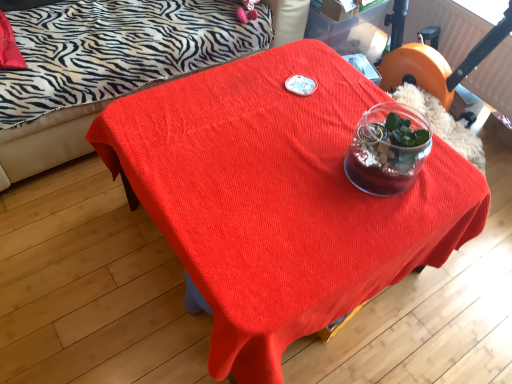
Question: Is orange plastic swivel chair at upper right completely or partially inside matte red table at center?

Choices:
 (A) no
 (B) yes

Answer: (A)

Question: Is matte red table at center thinner than orange plastic swivel chair at upper right?

Choices:
 (A) yes
 (B) no

Answer: (B)

Question: Considering the relative sizes of matte red table at center and orange plastic swivel chair at upper right in the image provided, is matte red table at center smaller than orange plastic swivel chair at upper right?

Choices:
 (A) yes
 (B) no

Answer: (B)

Question: Considering the relative sizes of matte red table at center and orange plastic swivel chair at upper right in the image provided, is matte red table at center shorter than orange plastic swivel chair at upper right?

Choices:
 (A) no
 (B) yes

Answer: (A)

Question: Is matte red table at center to the right of orange plastic swivel chair at upper right from the viewer's perspective?

Choices:
 (A) no
 (B) yes

Answer: (A)

Question: In the image, is orange plastic swivel chair at upper right on the left side or the right side of matte red table at center?

Choices:
 (A) left
 (B) right

Answer: (B)

Question: Is orange plastic swivel chair at upper right inside the boundaries of matte red table at center, or outside?

Choices:
 (A) outside
 (B) inside

Answer: (A)

Question: Considering the positions of orange plastic swivel chair at upper right and matte red table at center in the image, is orange plastic swivel chair at upper right taller or shorter than matte red table at center?

Choices:
 (A) tall
 (B) short

Answer: (B)

Question: From a real-world perspective, is orange plastic swivel chair at upper right positioned above or below matte red table at center?

Choices:
 (A) above
 (B) below

Answer: (A)

Question: Is matte red table at center taller or shorter than orange plastic swivel chair at upper right?

Choices:
 (A) tall
 (B) short

Answer: (A)

Question: Relative to orange plastic swivel chair at upper right, is matte red table at center in front or behind?

Choices:
 (A) front
 (B) behind

Answer: (A)

Question: From a real-world perspective, relative to orange plastic swivel chair at upper right, is matte red table at center vertically above or below?

Choices:
 (A) above
 (B) below

Answer: (B)

Question: In terms of size, does matte red table at center appear bigger or smaller than orange plastic swivel chair at upper right?

Choices:
 (A) big
 (B) small

Answer: (A)

Question: Considering the positions of orange plastic swivel chair at upper right and zebra-patterned fabric couch at upper left in the image, is orange plastic swivel chair at upper right bigger or smaller than zebra-patterned fabric couch at upper left?

Choices:
 (A) big
 (B) small

Answer: (B)

Question: From a real-world perspective, is orange plastic swivel chair at upper right physically located above or below zebra-patterned fabric couch at upper left?

Choices:
 (A) below
 (B) above

Answer: (A)